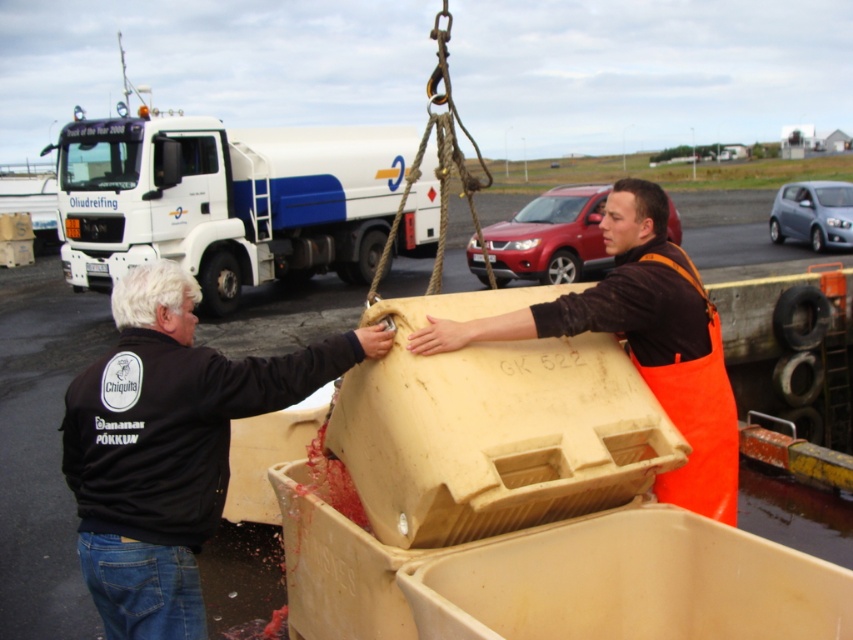
You are a safety inspector observing the workers at the dock. You notice two workers wearing protective gear. The first worker is wearing a black fabric jacket at left, and the second is wearing an orange apron at center. Which worker is wearing a smaller protective gear?

The black fabric jacket at left has a smaller size compared to the orange apron at center, so the worker wearing the black fabric jacket at left is wearing the smaller protective gear.

What is located at the point with coordinates (x=225, y=200) in the image?

The white glossy truck at upper left is located at point (x=225, y=200).